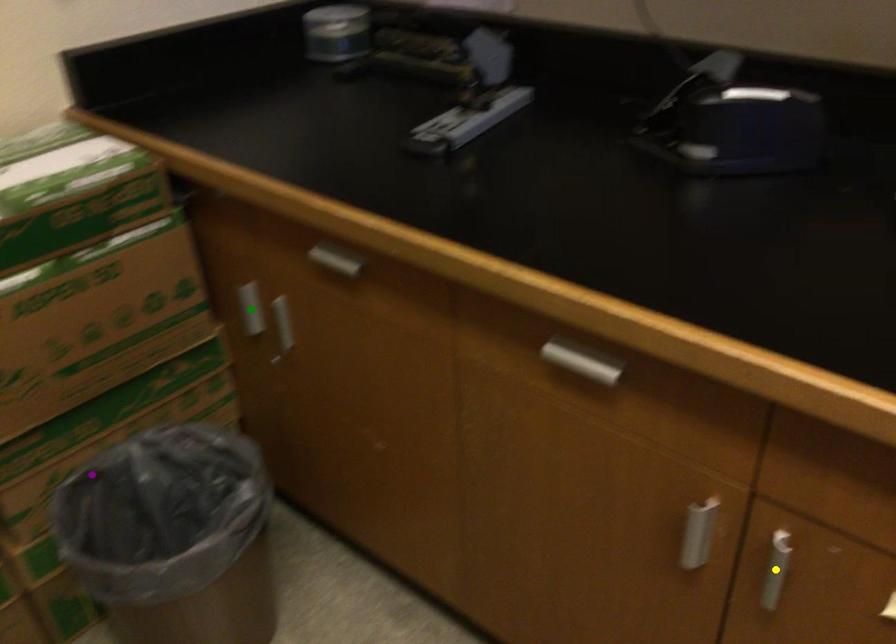
Order these from nearest to farthest:
- green point
- purple point
- yellow point

yellow point
purple point
green point